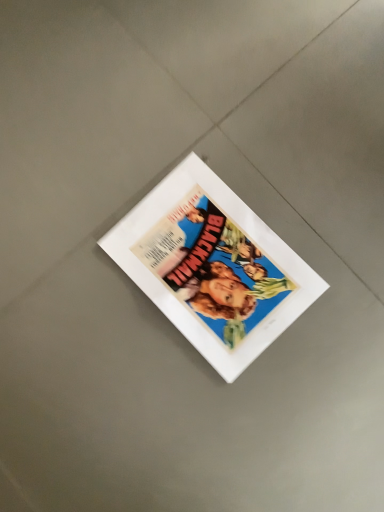
At what (x,y) coordinates should I click in order to perform the action: click on free point above matte white magazine at center (from a real-world perspective). Please return your answer as a coordinate pair (x, y). The height and width of the screenshot is (512, 384). Looking at the image, I should click on (216, 266).